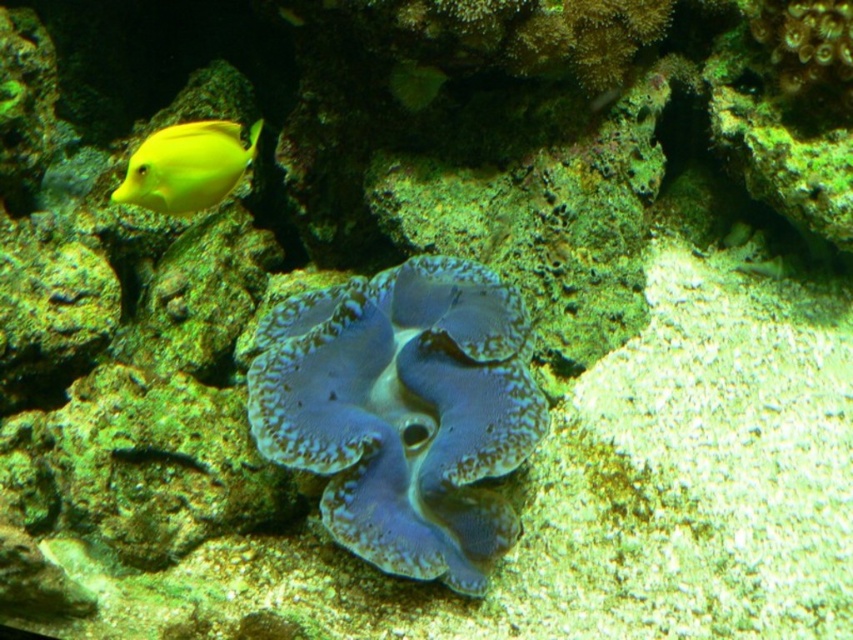
Question: Is blue textured clam at center closer to the viewer compared to yellow matte fish at upper left?

Choices:
 (A) yes
 (B) no

Answer: (A)

Question: Which object is closer to the camera taking this photo?

Choices:
 (A) yellow matte fish at upper left
 (B) blue textured clam at center

Answer: (B)

Question: Does blue textured clam at center have a lesser width compared to yellow matte fish at upper left?

Choices:
 (A) no
 (B) yes

Answer: (A)

Question: Is blue textured clam at center closer to the viewer compared to yellow matte fish at upper left?

Choices:
 (A) yes
 (B) no

Answer: (A)

Question: Which object appears farthest from the camera in this image?

Choices:
 (A) blue textured clam at center
 (B) yellow matte fish at upper left

Answer: (B)